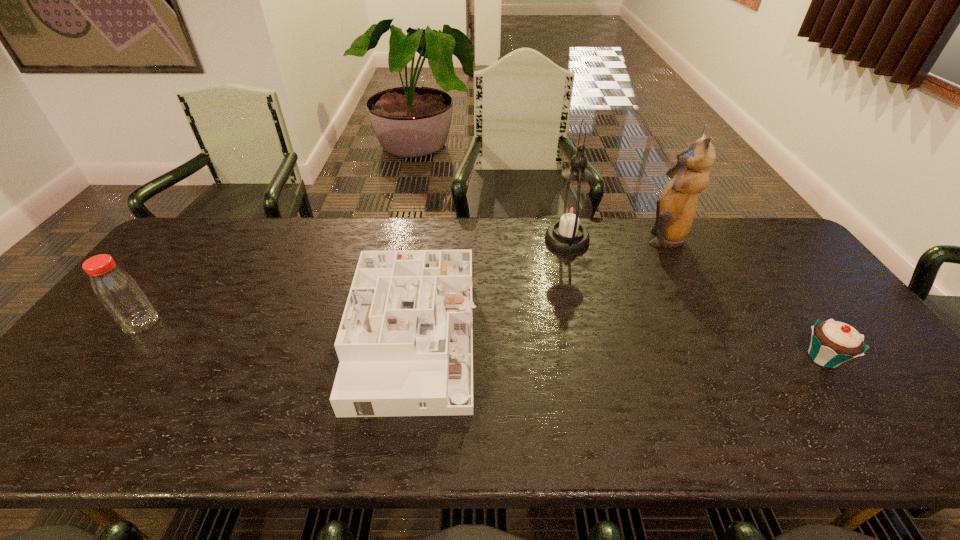
Identify the location of vacant area between the third object from left to right and the fourth object from right to left. This screenshot has height=540, width=960. (491, 291).

Locate an element on the screen. object that can be found as the third closest to the cat is located at coordinates [405, 343].

Select which object appears as the third closest to the cat. Please provide its 2D coordinates. Your answer should be formatted as a tuple, i.e. [(x, y)], where the tuple contains the x and y coordinates of a point satisfying the conditions above.

[(405, 343)]

At what (x,y) coordinates should I click in order to perform the action: click on vacant area that satisfies the following two spatial constraints: 1. on the face of the second object from right to left; 2. on the front side of the third object from right to left. Please return your answer as a coordinate pair (x, y). Looking at the image, I should click on (666, 240).